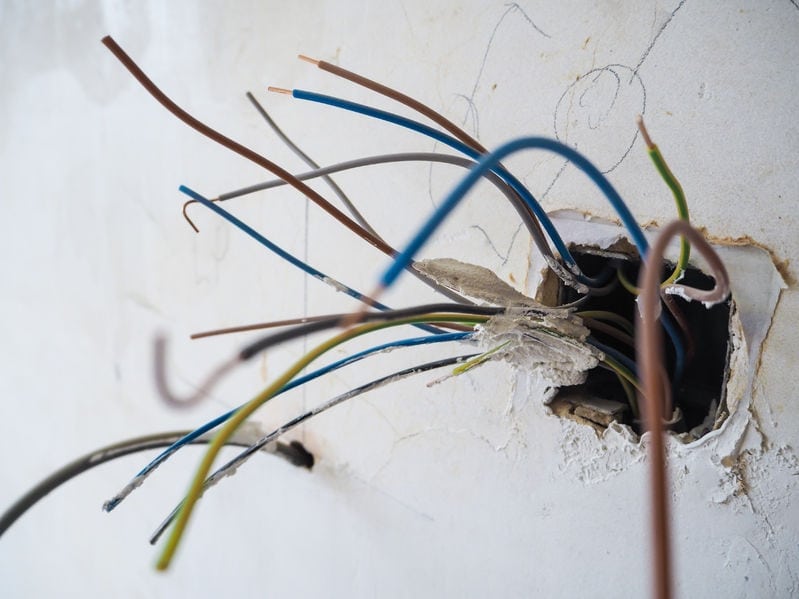
At what (x,y) coordinates should I click in order to perform the action: click on pencil lines on wall. Please return your answer as a coordinate pair (x, y). Image resolution: width=799 pixels, height=599 pixels. Looking at the image, I should click on (635, 63), (483, 50), (304, 280).